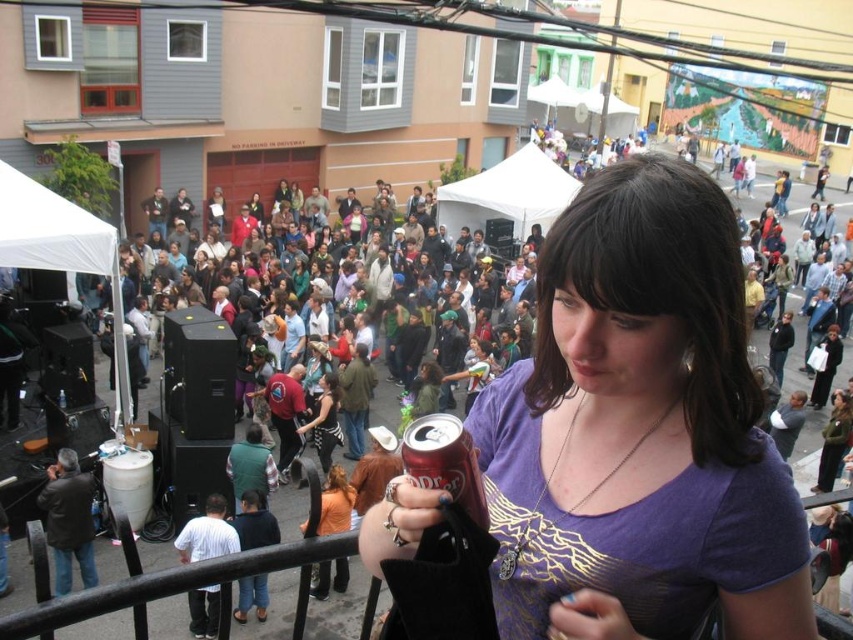
Is point (531, 630) farther from camera compared to point (218, 205)?

No, (531, 630) is in front of (218, 205).

Is purple matte shirt at center closer to camera compared to matte black jacket at center?

Yes, it is.

Where is `purple matte shirt at center`? purple matte shirt at center is located at coordinates (639, 429).

Is metallic red can at center taller than matte black jacket at center?

In fact, metallic red can at center may be shorter than matte black jacket at center.

Does metallic red can at center come in front of matte black jacket at center?

Yes, metallic red can at center is closer to the viewer.

Locate an element on the screen. The height and width of the screenshot is (640, 853). metallic red can at center is located at coordinates (444, 461).

Is point (444, 417) farther from viewer compared to point (318, 433)?

No, (444, 417) is in front of (318, 433).

Identify the location of metallic red can at center. (444, 461).